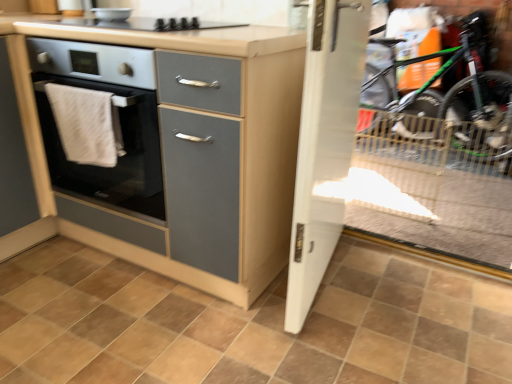
What are the coordinates of `vacant space to the right of white glossy door at center` in the screenshot? It's located at (413, 296).